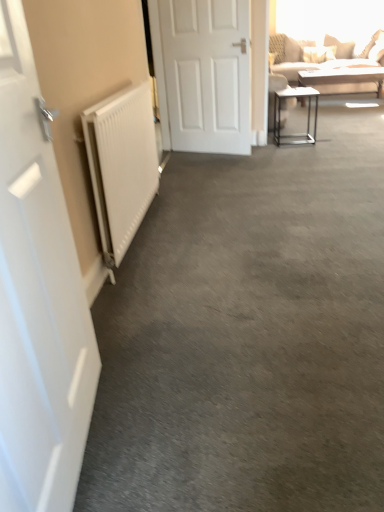
Question: Can you confirm if white matte radiator at left is smaller than white matte door at left, acting as the first door starting from the front?

Choices:
 (A) no
 (B) yes

Answer: (A)

Question: Does white matte radiator at left appear on the left side of white matte door at left, acting as the 1th door starting from the bottom?

Choices:
 (A) yes
 (B) no

Answer: (B)

Question: Is white matte radiator at left aimed at white matte door at left, arranged as the 1th door when viewed from the left?

Choices:
 (A) yes
 (B) no

Answer: (B)

Question: From a real-world perspective, is white matte radiator at left beneath white matte door at left, the 2th door in the back-to-front sequence?

Choices:
 (A) yes
 (B) no

Answer: (A)

Question: From the image's perspective, is white matte radiator at left beneath white matte door at left, the 2th door in the back-to-front sequence?

Choices:
 (A) yes
 (B) no

Answer: (B)

Question: Is white matte radiator at left closer to the viewer compared to white matte door at left, the 2th door in the back-to-front sequence?

Choices:
 (A) yes
 (B) no

Answer: (B)

Question: From the image's perspective, is metallic silver table at right, positioned as the first table in bottom-to-top order, on top of white matte radiator at left?

Choices:
 (A) no
 (B) yes

Answer: (B)

Question: From a real-world perspective, is metallic silver table at right, which ranks as the first table in left-to-right order, located beneath white matte radiator at left?

Choices:
 (A) no
 (B) yes

Answer: (B)

Question: From the image's perspective, is metallic silver table at right, which appears as the 2th table when viewed from the top, located beneath white matte radiator at left?

Choices:
 (A) no
 (B) yes

Answer: (A)

Question: Is metallic silver table at right, positioned as the 2th table in back-to-front order, shorter than white matte radiator at left?

Choices:
 (A) no
 (B) yes

Answer: (B)

Question: Can you confirm if metallic silver table at right, positioned as the 2th table in back-to-front order, is positioned to the right of white matte radiator at left?

Choices:
 (A) no
 (B) yes

Answer: (B)

Question: Is metallic silver table at right, the 1th table viewed from the front, placed right next to white matte radiator at left?

Choices:
 (A) no
 (B) yes

Answer: (A)

Question: Is metallic silver table at right, which ranks as the first table in left-to-right order, taller than white matte door at left, the second door when ordered from right to left?

Choices:
 (A) yes
 (B) no

Answer: (B)